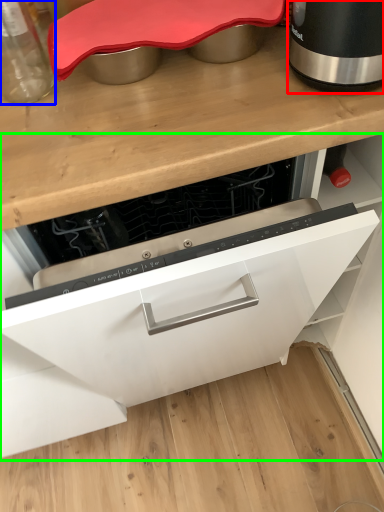
Question: Estimate the real-world distances between objects in this image. Which object is farther from home appliance (highlighted by a red box), kitchen appliance (highlighted by a blue box) or cabinetry (highlighted by a green box)?

Choices:
 (A) kitchen appliance
 (B) cabinetry

Answer: (B)